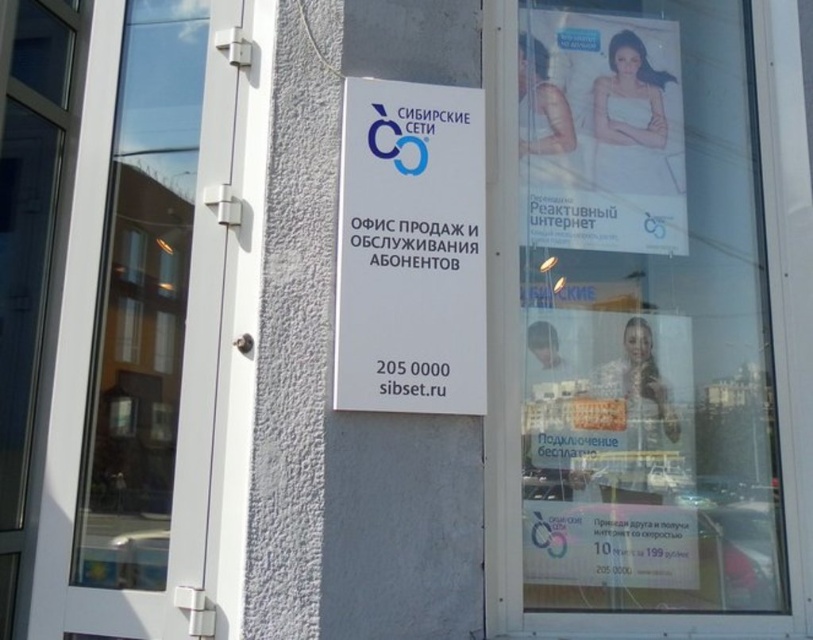
Question: Does transparent glass window at left appear on the right side of white glossy poster at upper right?

Choices:
 (A) no
 (B) yes

Answer: (A)

Question: Which point is farther to the camera?

Choices:
 (A) (418, 177)
 (B) (177, 10)
 (C) (525, 416)
 (D) (575, 243)

Answer: (D)

Question: Is the position of white paper poster at upper right more distant than that of transparent glass window at left?

Choices:
 (A) no
 (B) yes

Answer: (A)

Question: Which is farther from the white plastic sign at center?

Choices:
 (A) transparent glass window at left
 (B) white glossy poster at upper right
 (C) white paper poster at upper right

Answer: (A)

Question: Which object is closer to the camera taking this photo?

Choices:
 (A) white paper poster at upper right
 (B) white glossy poster at upper right
 (C) white plastic sign at center
 (D) transparent glass window at left

Answer: (C)

Question: Where is transparent glass window at left located in relation to white plastic sign at center in the image?

Choices:
 (A) above
 (B) below

Answer: (B)